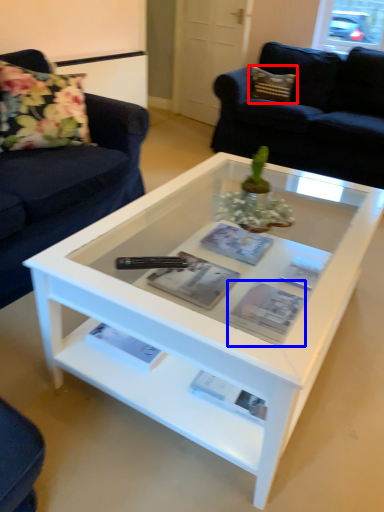
Question: Which of the following is the farthest to the observer, pillow (highlighted by a red box) or magazine (highlighted by a blue box)?

Choices:
 (A) pillow
 (B) magazine

Answer: (A)